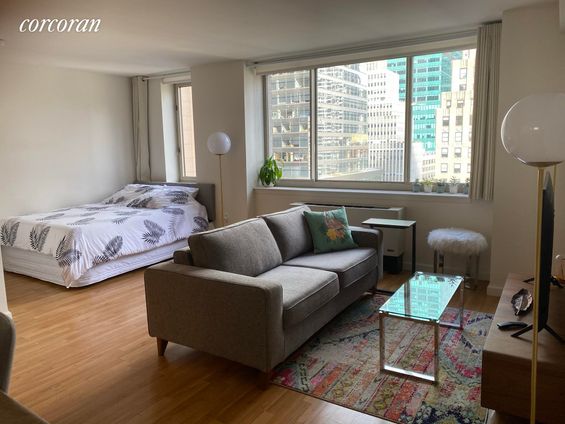
Locate an element on the screen. This screenshot has height=424, width=565. headboard is located at coordinates (201, 194).